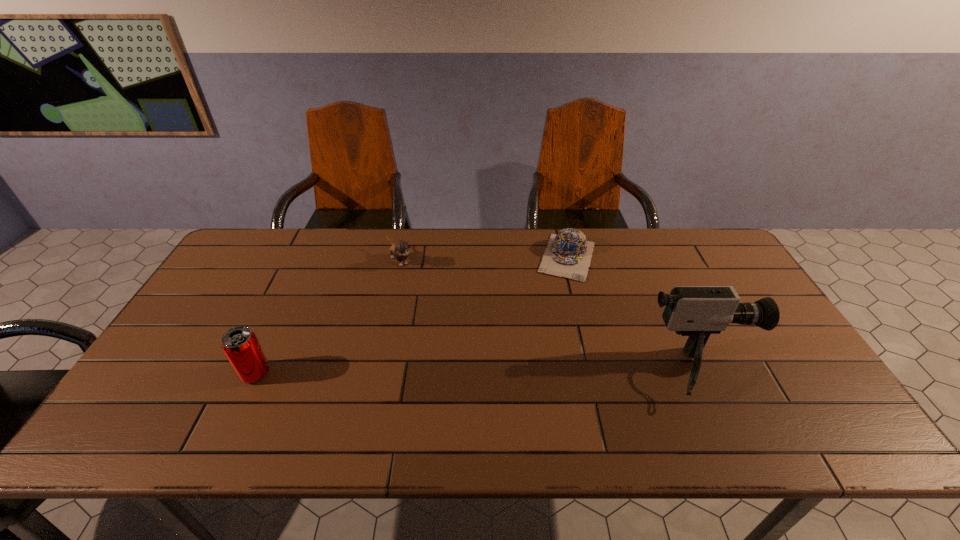
Locate which object is the third closest to the second object from right to left. Please provide its 2D coordinates. Your answer should be formatted as a tuple, i.e. [(x, y)], where the tuple contains the x and y coordinates of a point satisfying the conditions above.

[(240, 345)]

Select which object appears as the third closest to the kitten. Please provide its 2D coordinates. Your answer should be formatted as a tuple, i.e. [(x, y)], where the tuple contains the x and y coordinates of a point satisfying the conditions above.

[(696, 311)]

At what (x,y) coordinates should I click in order to perform the action: click on vacant area that satisfies the following two spatial constraints: 1. on the front side of the camcorder; 2. on the recording direction of the shortest object. Please return your answer as a coordinate pair (x, y). Image resolution: width=960 pixels, height=540 pixels. Looking at the image, I should click on (595, 373).

Identify the location of vacant space that satisfies the following two spatial constraints: 1. on the back side of the tallest object; 2. on the recording direction of the second tallest object. The height and width of the screenshot is (540, 960). (255, 373).

Where is `free space that satisfies the following two spatial constraints: 1. on the front side of the second object from left to right; 2. on the recording direction of the camcorder`? free space that satisfies the following two spatial constraints: 1. on the front side of the second object from left to right; 2. on the recording direction of the camcorder is located at coordinates (375, 373).

Identify the location of vacant region that satisfies the following two spatial constraints: 1. on the front side of the rightmost object; 2. on the recording direction of the shortest object. (595, 373).

Locate an element on the screen. free space that satisfies the following two spatial constraints: 1. on the back side of the second object from left to right; 2. on the left side of the third shortest object is located at coordinates (308, 260).

Identify the location of vacant position in the image that satisfies the following two spatial constraints: 1. on the front side of the rightmost object; 2. on the recording direction of the cap. Image resolution: width=960 pixels, height=540 pixels. (595, 373).

Where is `vacant region that satisfies the following two spatial constraints: 1. on the front side of the second shortest object; 2. on the recording direction of the rightmost object`? vacant region that satisfies the following two spatial constraints: 1. on the front side of the second shortest object; 2. on the recording direction of the rightmost object is located at coordinates (375, 373).